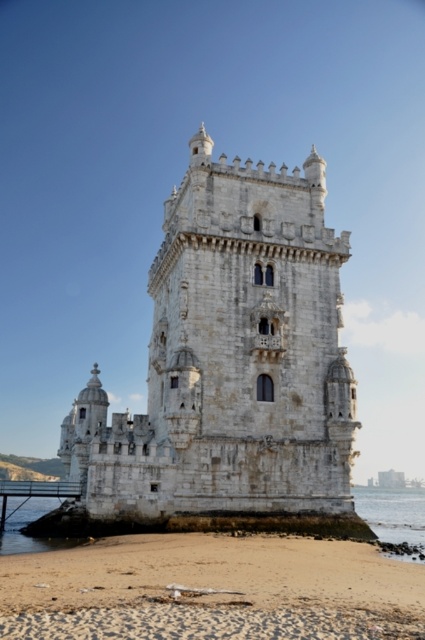
You are a tourist standing at the base of the white stone tower at center and want to throw a pebble into the clear water at lower right. Given that the pebble can travel 80 feet, will it reach the water?

The distance between the white stone tower at center and the clear water at lower right is 83.78 feet, which is slightly farther than the pebble can travel. Therefore, the pebble will not reach the water.